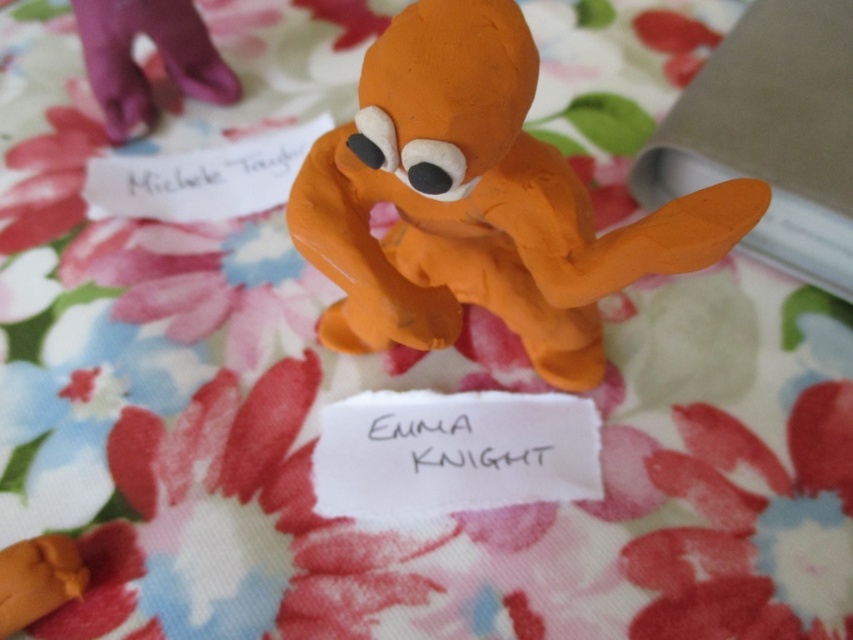
You are an art curator arranging a display. You have two points marked in the scene. The first point is at coordinates point (412,308), and the second point is at coordinates point (287,163). According to the scene description, which point is closer to the viewer?

Point (412,308) is closer to the viewer because it is in front of point (287,163).

You are an art curator preparing an exhibition. You have two pieces of paper in front of you, the black paper at center and the matte white paper at upper left. Which paper is narrower?

The black paper at center has a lesser width compared to matte white paper at upper left, so the black paper at center is narrower.

You are an art student who wants to display both the orange clay dog at center and the matte white paper at upper left on a shelf. The shelf has a height limit of 15 cm. Can both items be displayed together without exceeding the height limit?

The orange clay dog at center has a greater height compared to matte white paper at upper left. Since the shelf has a height limit of 15 cm, both items can be displayed together as long as the orange clay dog at center is within the 15 cm limit. However, if the dog exceeds 15 cm, the white paper might still fit individually.